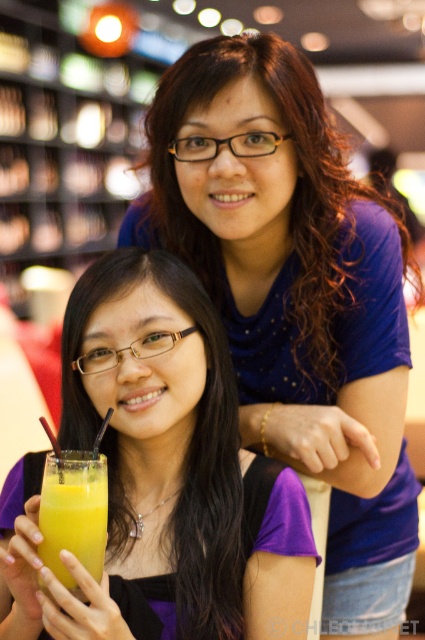
Question: Estimate the real-world distances between objects in this image. Which object is closer to the purple matte shirt at center?

Choices:
 (A) orange juice at lower left
 (B) matte blue shirt at upper center

Answer: (A)

Question: Is purple matte shirt at center positioned before orange juice at lower left?

Choices:
 (A) yes
 (B) no

Answer: (A)

Question: Among these objects, which one is nearest to the camera?

Choices:
 (A) matte blue shirt at upper center
 (B) purple matte shirt at center
 (C) orange juice at lower left

Answer: (B)

Question: In this image, where is purple matte shirt at center located relative to orange juice at lower left?

Choices:
 (A) left
 (B) right

Answer: (B)

Question: Does matte blue shirt at upper center have a greater width compared to purple matte shirt at center?

Choices:
 (A) yes
 (B) no

Answer: (A)

Question: Which object is positioned farthest from the orange juice at lower left?

Choices:
 (A) matte blue shirt at upper center
 (B) purple matte shirt at center

Answer: (A)